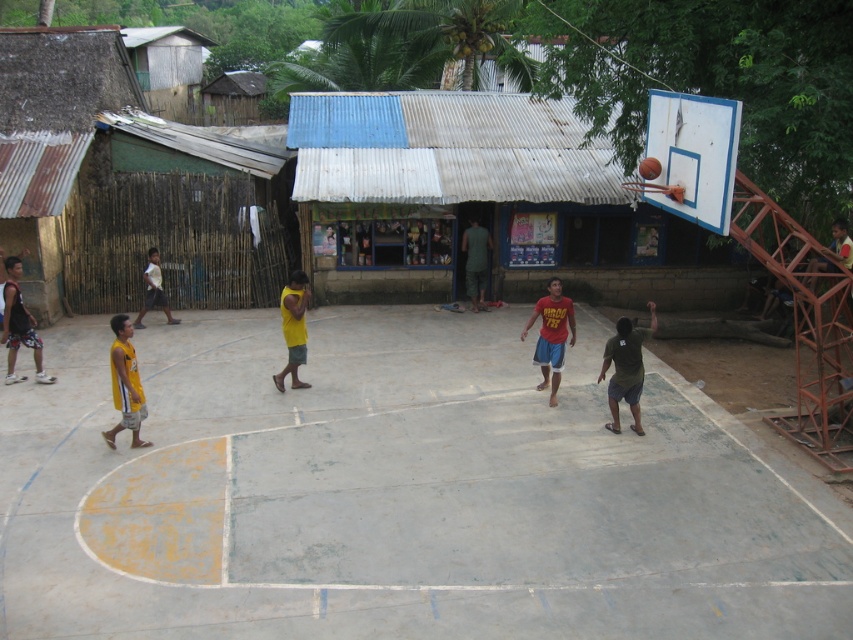
You are a photographer standing at the edge of the concrete basketball court at center. You want to take a picture of the matte black shorts at left and the court. Since the court is higher than the shorts, how should you adjust your camera angle to include both in the frame?

Since the concrete basketball court at center is higher than the matte black shorts at left, you should angle your camera downward to capture both the elevated court and the lower positioned shorts in the frame.